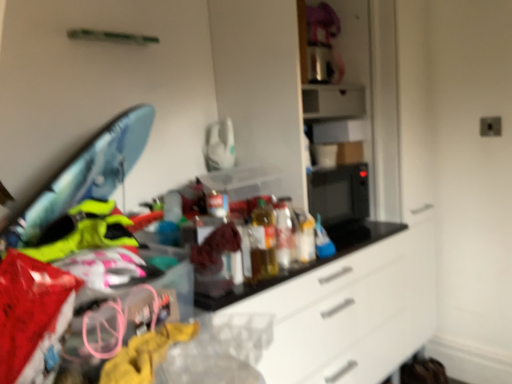
What do you see at coordinates (263, 243) in the screenshot? Image resolution: width=512 pixels, height=384 pixels. I see `translucent plastic bottles at center` at bounding box center [263, 243].

Measure the distance between translucent plastic bottles at center and camera.

The depth of translucent plastic bottles at center is 4.67 feet.

In order to face translucent plastic bottles at center, should I rotate leftwards or rightwards?

Rotate your view right by about 0.598°.

You are a GUI agent. You are given a task and a screenshot of the screen. Output one action in this format:
    pyautogui.click(x=<x>, y=<y>)
    Task: Click on the translucent plastic bottles at center
    The height and width of the screenshot is (384, 512).
    Given the screenshot: What is the action you would take?
    pyautogui.click(x=263, y=243)

What do you see at coordinates (332, 101) in the screenshot?
I see `metallic silver toaster at upper center` at bounding box center [332, 101].

This screenshot has height=384, width=512. Find the location of `metallic silver toaster at upper center`. metallic silver toaster at upper center is located at coordinates (332, 101).

Where is `translucent plastic bottles at center`? translucent plastic bottles at center is located at coordinates (263, 243).

Between translucent plastic bottles at center and metallic silver toaster at upper center, which one appears on the right side from the viewer's perspective?

From the viewer's perspective, metallic silver toaster at upper center appears more on the right side.

Which object is closer to the camera taking this photo, translucent plastic bottles at center or metallic silver toaster at upper center?

translucent plastic bottles at center is in front.

Does point (265, 208) come farther from viewer compared to point (324, 96)?

No, it is in front of (324, 96).

From the image's perspective, who appears lower, translucent plastic bottles at center or metallic silver toaster at upper center?

translucent plastic bottles at center, from the image's perspective.

From a real-world perspective, between translucent plastic bottles at center and metallic silver toaster at upper center, who is vertically lower?

From a 3D spatial view, translucent plastic bottles at center is below.

Which object is thinner, translucent plastic bottles at center or metallic silver toaster at upper center?

translucent plastic bottles at center is thinner.

Who is taller, translucent plastic bottles at center or metallic silver toaster at upper center?

translucent plastic bottles at center.

Which of these two, translucent plastic bottles at center or metallic silver toaster at upper center, is bigger?

metallic silver toaster at upper center is bigger.

Is translucent plastic bottles at center inside the boundaries of metallic silver toaster at upper center, or outside?

translucent plastic bottles at center lies outside metallic silver toaster at upper center.

Is translucent plastic bottles at center with metallic silver toaster at upper center?

translucent plastic bottles at center and metallic silver toaster at upper center are clearly separated.

Does translucent plastic bottles at center turn towards metallic silver toaster at upper center?

No, translucent plastic bottles at center does not turn towards metallic silver toaster at upper center.

You are a GUI agent. You are given a task and a screenshot of the screen. Output one action in this format:
    pyautogui.click(x=<x>, y=<y>)
    Task: Click on the bottle on the left side of metallic silver toaster at upper center
    This screenshot has height=384, width=512.
    Given the screenshot: What is the action you would take?
    pyautogui.click(x=263, y=243)

In the scene shown: Considering the positions of objects metallic silver toaster at upper center and translucent plastic bottles at center in the image provided, who is more to the left, metallic silver toaster at upper center or translucent plastic bottles at center?

translucent plastic bottles at center is more to the left.

In the scene shown: Considering the positions of objects metallic silver toaster at upper center and translucent plastic bottles at center in the image provided, who is in front, metallic silver toaster at upper center or translucent plastic bottles at center?

translucent plastic bottles at center.

Which is farther, (x=330, y=85) or (x=261, y=233)?

Positioned behind is point (x=330, y=85).

From the image's perspective, who appears lower, metallic silver toaster at upper center or translucent plastic bottles at center?

From the image's view, translucent plastic bottles at center is below.

From the picture: From a real-world perspective, which object stands above the other?

metallic silver toaster at upper center, from a real-world perspective.

Considering the sizes of metallic silver toaster at upper center and translucent plastic bottles at center in the image, is metallic silver toaster at upper center wider or thinner than translucent plastic bottles at center?

Clearly, metallic silver toaster at upper center has more width compared to translucent plastic bottles at center.

Considering the relative sizes of metallic silver toaster at upper center and translucent plastic bottles at center in the image provided, is metallic silver toaster at upper center taller than translucent plastic bottles at center?

In fact, metallic silver toaster at upper center may be shorter than translucent plastic bottles at center.

Considering the sizes of objects metallic silver toaster at upper center and translucent plastic bottles at center in the image provided, who is smaller, metallic silver toaster at upper center or translucent plastic bottles at center?

translucent plastic bottles at center.

Would you say metallic silver toaster at upper center is outside translucent plastic bottles at center?

Absolutely, metallic silver toaster at upper center is external to translucent plastic bottles at center.

Is there a large distance between metallic silver toaster at upper center and translucent plastic bottles at center?

metallic silver toaster at upper center is near translucent plastic bottles at center, not far away.

Could you tell me if metallic silver toaster at upper center is turned towards translucent plastic bottles at center?

No, metallic silver toaster at upper center is not facing towards translucent plastic bottles at center.

How different are the orientations of metallic silver toaster at upper center and translucent plastic bottles at center in degrees?

2.99 degrees separate the facing orientations of metallic silver toaster at upper center and translucent plastic bottles at center.

At what (x,y) coordinates should I click in order to perform the action: click on bottle that appears on the left of metallic silver toaster at upper center. Please return your answer as a coordinate pair (x, y). The image size is (512, 384). Looking at the image, I should click on (263, 243).

This screenshot has height=384, width=512. I want to click on bottle on the left of the metallic silver toaster at upper center, so click(263, 243).

Locate an element on the screen. This screenshot has width=512, height=384. bottle that is below the metallic silver toaster at upper center (from the image's perspective) is located at coordinates (263, 243).